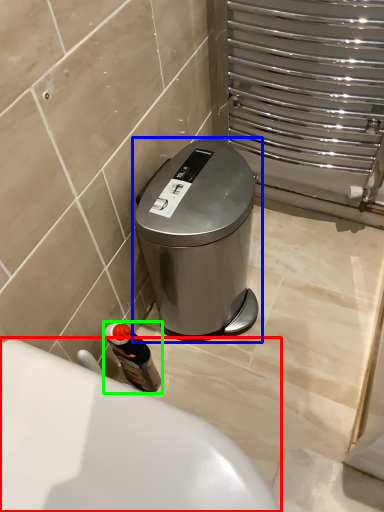
Question: Considering the real-world distances, which object is closest to bath (highlighted by a red box)? waste container (highlighted by a blue box) or bottle (highlighted by a green box).

Choices:
 (A) waste container
 (B) bottle

Answer: (B)